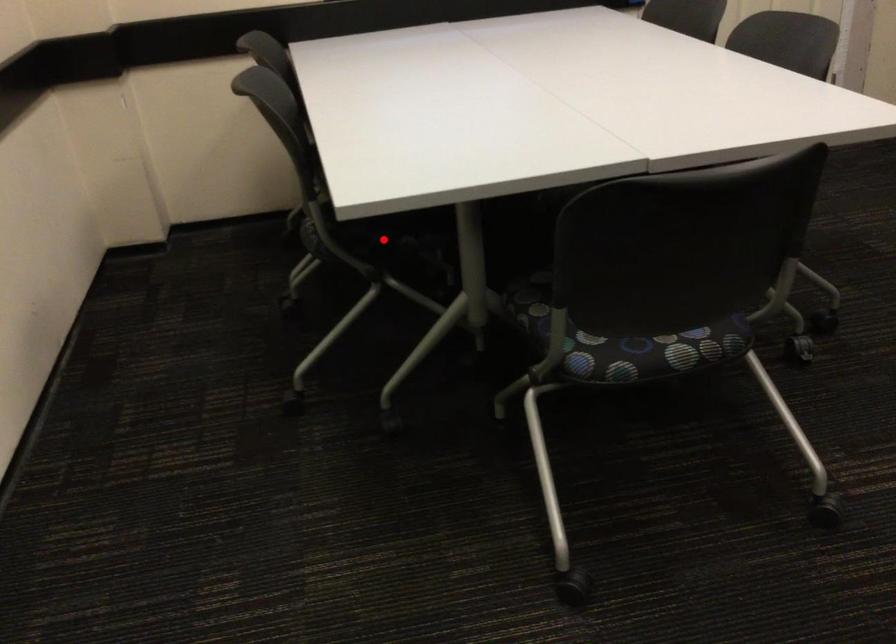
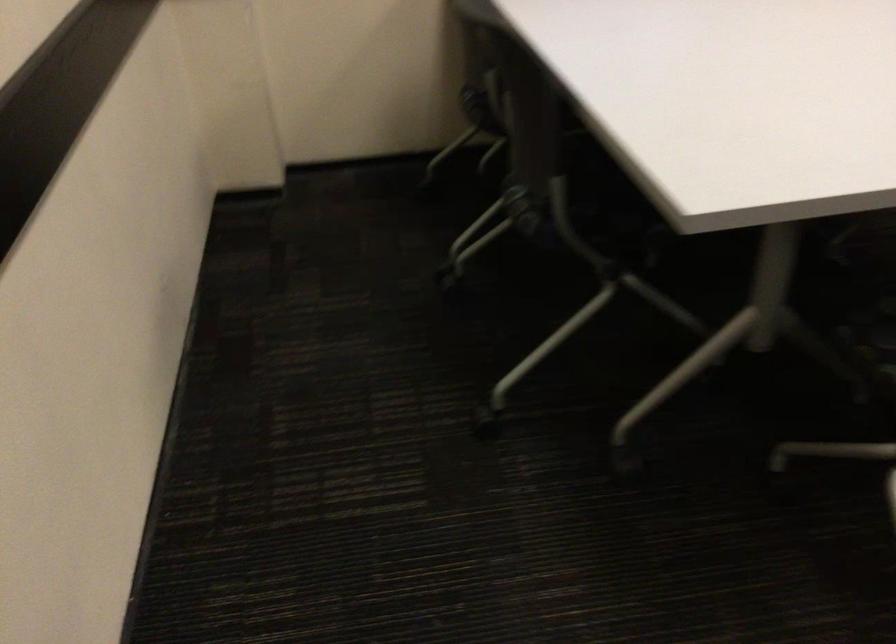
Question: I am providing you with two images of the same scene from different viewpoints. A red point is shown in image1. For the corresponding object point in image2, is it positioned nearer or farther from the camera?

Choices:
 (A) Nearer
 (B) Farther

Answer: (A)